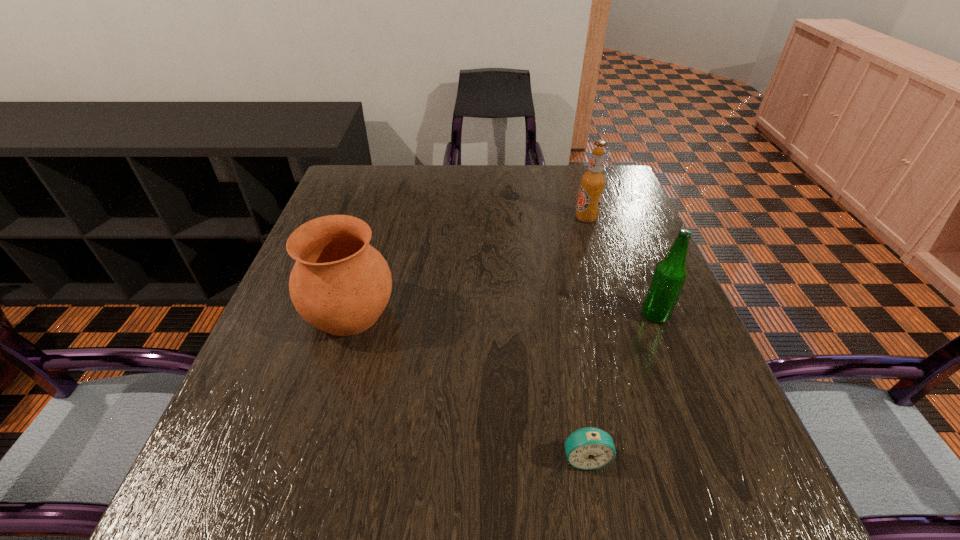
Where is `free space at the far right corner`? This screenshot has width=960, height=540. free space at the far right corner is located at coordinates (582, 175).

At what (x,y) coordinates should I click in order to perform the action: click on blank space at the near right corner of the desktop. Please return your answer as a coordinate pair (x, y). Looking at the image, I should click on (697, 485).

The width and height of the screenshot is (960, 540). Identify the location of empty space between the nearer beer bottle and the pottery. (502, 314).

You are a GUI agent. You are given a task and a screenshot of the screen. Output one action in this format:
    pyautogui.click(x=<x>, y=<y>)
    Task: Click on the empty space between the farthest object and the pottery
    
    Given the screenshot: What is the action you would take?
    pyautogui.click(x=468, y=265)

Where is `vacant space that's between the leftmost object and the alarm clock`? This screenshot has width=960, height=540. vacant space that's between the leftmost object and the alarm clock is located at coordinates (468, 385).

The height and width of the screenshot is (540, 960). What are the coordinates of `vacant area that lies between the rightmost object and the pottery` in the screenshot? It's located at (502, 314).

At what (x,y) coordinates should I click in order to perform the action: click on vacant area that lies between the nearest object and the left beer bottle. Please return your answer as a coordinate pair (x, y). This screenshot has height=540, width=960. Looking at the image, I should click on pos(586,338).

This screenshot has height=540, width=960. I want to click on free point between the alarm clock and the farther beer bottle, so 586,338.

Find the location of a particular element. This screenshot has height=540, width=960. vacant space that is in between the nearer beer bottle and the alarm clock is located at coordinates (620, 386).

Where is `unoccupied position between the shortest object and the leftmost object`? This screenshot has height=540, width=960. unoccupied position between the shortest object and the leftmost object is located at coordinates (468, 385).